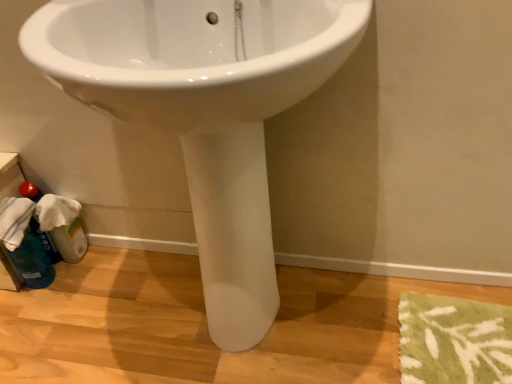
Locate an element on the screen. vacant space to the right of white glossy sink at center is located at coordinates [406, 320].